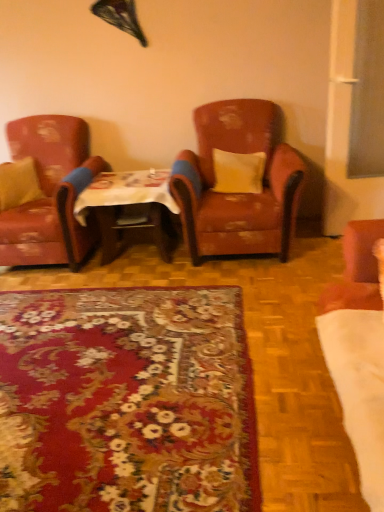
Find the location of `free region under wooden table at center (from a real-world perspective)`. free region under wooden table at center (from a real-world perspective) is located at coordinates (144, 256).